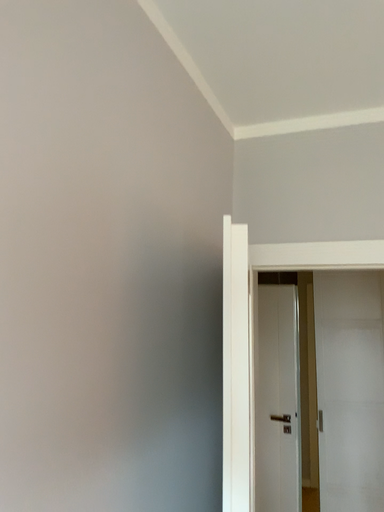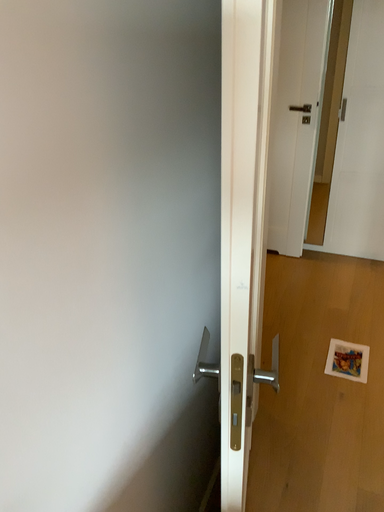
Question: How did the camera likely rotate when shooting the video?

Choices:
 (A) rotated upward
 (B) rotated downward

Answer: (B)